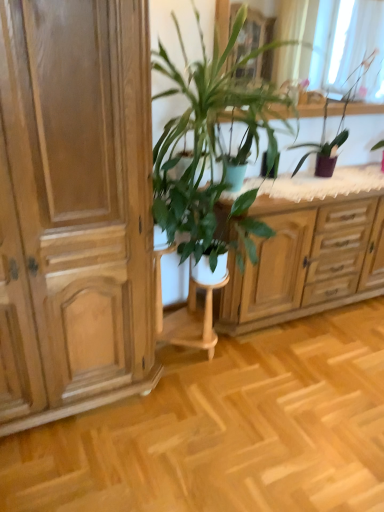
Find the location of a particular element. free space in front of light wood cabinet at center is located at coordinates (304, 389).